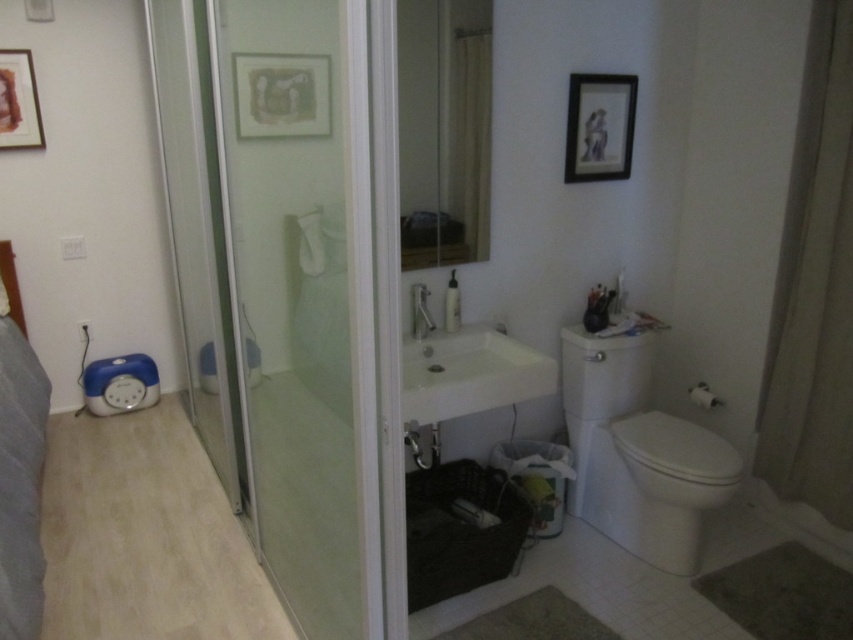
At what (x,y) coordinates should I click in order to perform the action: click on matte paper picture frame at upper center. Please return your answer as a coordinate pair (x, y). The width and height of the screenshot is (853, 640). Looking at the image, I should click on (281, 93).

From the picture: Can you confirm if matte paper picture frame at upper center is shorter than matte black picture frame at upper center?

Yes.

Describe the element at coordinates (281, 93) in the screenshot. I see `matte paper picture frame at upper center` at that location.

Where is `matte paper picture frame at upper center`? matte paper picture frame at upper center is located at coordinates (281, 93).

Does transparent glass shower door at left have a greater width compared to wooden framed artwork at upper left?

Yes, transparent glass shower door at left is wider than wooden framed artwork at upper left.

Which is above, transparent glass shower door at left or wooden framed artwork at upper left?

Positioned higher is wooden framed artwork at upper left.

Who is more distant from viewer, (206,96) or (24,58)?

Positioned behind is point (24,58).

This screenshot has width=853, height=640. Identify the location of transparent glass shower door at left. (196, 228).

Who is taller, white glossy sink at center or matte black picture frame at upper center?

Standing taller between the two is matte black picture frame at upper center.

Locate an element on the screen. The image size is (853, 640). white glossy sink at center is located at coordinates (469, 372).

The image size is (853, 640). I want to click on white glossy sink at center, so click(x=469, y=372).